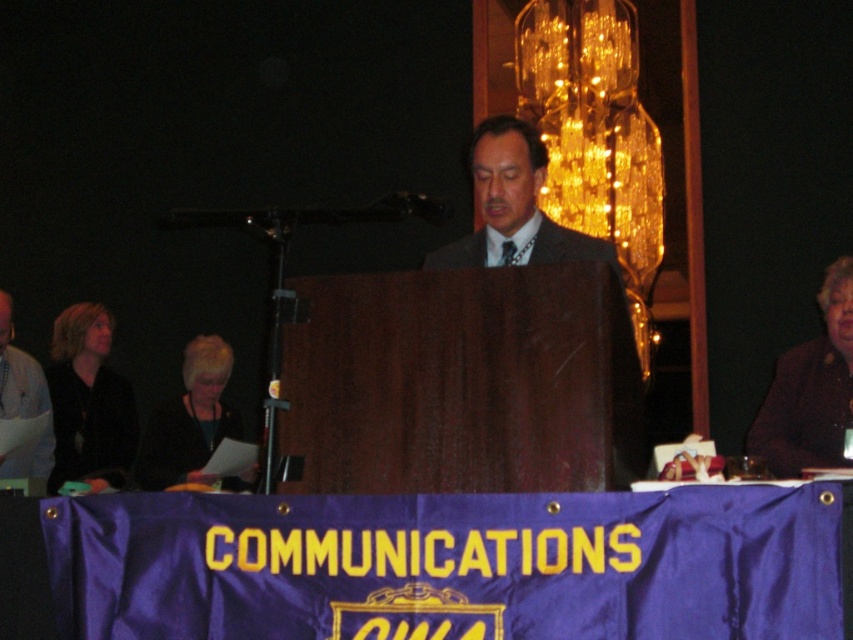
You are attending a formal event and notice a speaker at a dark wood podium. To your left, there is a banner with yellow text. Where is the dark brown hair at lower left in relation to the speaker?

The dark brown hair at lower left is located at point (x=192, y=422) relative to the speaker.

You are attending a conference and notice a speaker with dark brown hair at lower left and a purple fabric banner at center. Which object is closer to the front of the stage?

The dark brown hair at lower left is positioned over the purple fabric banner at center, indicating it is closer to the front of the stage.